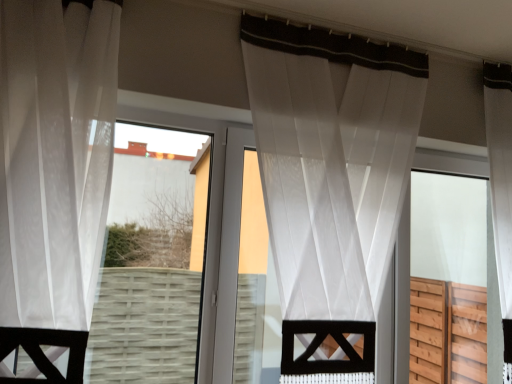
Question: In terms of width, does transparent wood screen door at right look wider or thinner when compared to white sheer curtain at left, the 1th curtain from the front?

Choices:
 (A) wide
 (B) thin

Answer: (B)

Question: Is transparent wood screen door at right bigger or smaller than white sheer curtain at left, placed as the 2th curtain when sorted from back to front?

Choices:
 (A) big
 (B) small

Answer: (A)

Question: Which object is positioned farthest from the white sheer curtain at left, the first curtain when ordered from left to right?

Choices:
 (A) sheer white curtain at center, the 2th curtain in the left-to-right sequence
 (B) transparent fabric at center
 (C) transparent wood screen door at right

Answer: (C)

Question: Considering the real-world distances, which object is farthest from the white sheer curtain at left, the 1th curtain from the front?

Choices:
 (A) transparent fabric at center
 (B) sheer white curtain at center, positioned as the 1th curtain in right-to-left order
 (C) transparent wood screen door at right

Answer: (C)